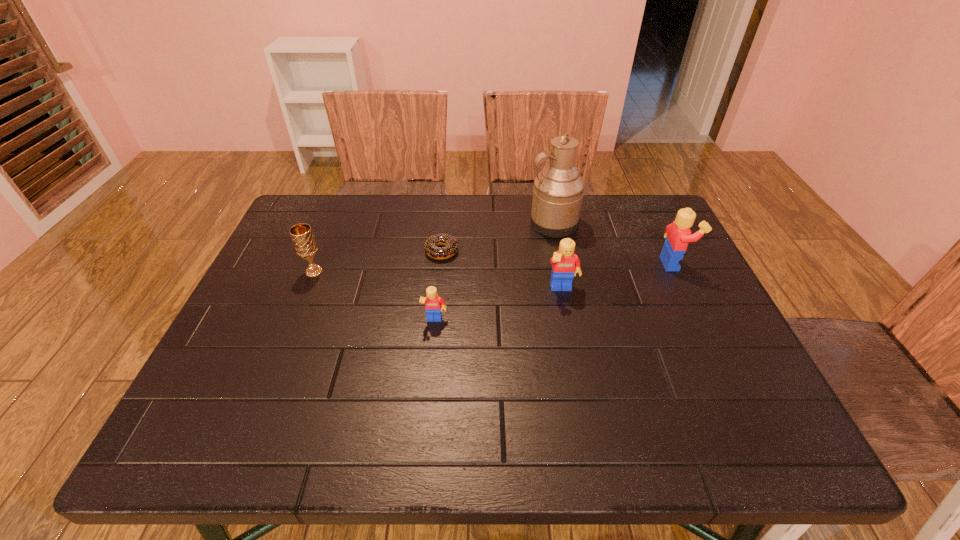
Identify the location of vacant place for an extra Lego on the left. This screenshot has width=960, height=540. (287, 356).